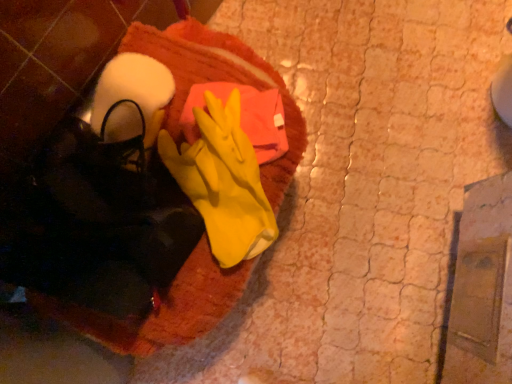
Question: In terms of width, does yellow rubber glove at center look wider or thinner when compared to orange towel at center?

Choices:
 (A) wide
 (B) thin

Answer: (B)

Question: Is yellow rubber glove at center inside the boundaries of orange towel at center, or outside?

Choices:
 (A) inside
 (B) outside

Answer: (A)

Question: From a real-world perspective, is yellow rubber glove at center physically located above or below orange towel at center?

Choices:
 (A) below
 (B) above

Answer: (B)

Question: Would you say orange towel at center is inside or outside yellow rubber glove at center?

Choices:
 (A) inside
 (B) outside

Answer: (B)

Question: In the image, is orange towel at center positioned in front of or behind yellow rubber glove at center?

Choices:
 (A) behind
 (B) front

Answer: (A)

Question: Does point (240, 51) appear closer or farther from the camera than point (206, 226)?

Choices:
 (A) closer
 (B) farther

Answer: (B)

Question: From a real-world perspective, is orange towel at center physically located above or below yellow rubber glove at center?

Choices:
 (A) above
 (B) below

Answer: (B)